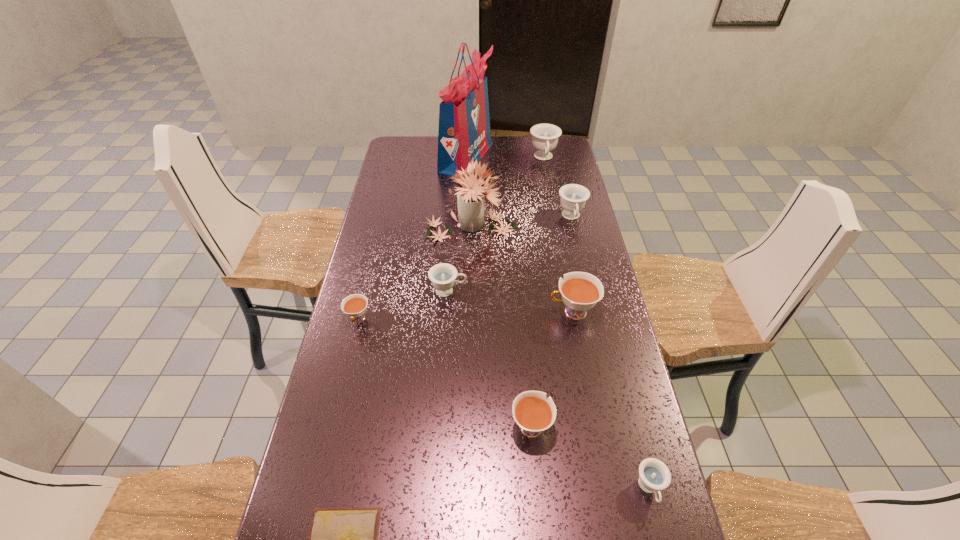
You are a GUI agent. You are given a task and a screenshot of the screen. Output one action in this format:
    pyautogui.click(x=<x>, y=<y>)
    Task: Click on the second nearest teacup
    This screenshot has height=540, width=960.
    Given the screenshot: What is the action you would take?
    pyautogui.click(x=534, y=414)

You are a GUI agent. You are given a task and a screenshot of the screen. Output one action in this format:
    pyautogui.click(x=<x>, y=<y>)
    Task: Click on the sixth teacup from right to left
    The width and height of the screenshot is (960, 540).
    Given the screenshot: What is the action you would take?
    pyautogui.click(x=443, y=275)

The image size is (960, 540). In order to click on the second smallest blue teacup in this screenshot , I will do `click(443, 275)`.

Find the location of `the leftmost teacup`. the leftmost teacup is located at coordinates (355, 305).

Image resolution: width=960 pixels, height=540 pixels. What are the coordinates of `the leftmost white teacup` in the screenshot? It's located at (355, 305).

The image size is (960, 540). In order to click on the nearest blue teacup in this screenshot , I will do `click(654, 475)`.

Where is `the nearest teacup`? the nearest teacup is located at coordinates (654, 475).

Locate an element on the screen. Image resolution: width=960 pixels, height=540 pixels. free space located on the front-facing side of the red grocery bag is located at coordinates [x=546, y=157].

This screenshot has height=540, width=960. Identify the location of free space located 0.150m on the right of the bouquet. (558, 226).

Where is `free space located 0.360m on the side of the biggest blue teacup with the handle`? This screenshot has height=540, width=960. free space located 0.360m on the side of the biggest blue teacup with the handle is located at coordinates (556, 221).